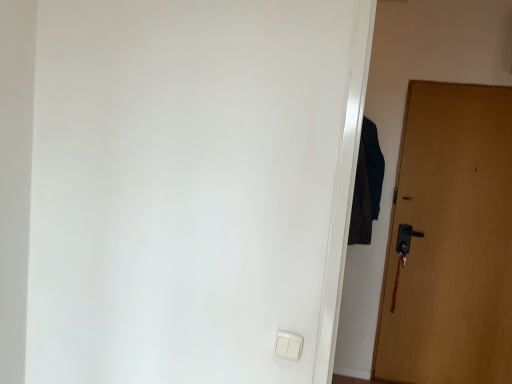
Question: Does wooden door at right appear on the left side of dark blue fabric at right?

Choices:
 (A) no
 (B) yes

Answer: (A)

Question: Considering the relative sizes of wooden door at right and dark blue fabric at right in the image provided, is wooden door at right shorter than dark blue fabric at right?

Choices:
 (A) yes
 (B) no

Answer: (B)

Question: Can you confirm if wooden door at right is bigger than dark blue fabric at right?

Choices:
 (A) yes
 (B) no

Answer: (A)

Question: From the image's perspective, would you say wooden door at right is positioned over dark blue fabric at right?

Choices:
 (A) no
 (B) yes

Answer: (A)

Question: Is wooden door at right thinner than dark blue fabric at right?

Choices:
 (A) no
 (B) yes

Answer: (B)

Question: Considering the relative sizes of wooden door at right and dark blue fabric at right in the image provided, is wooden door at right smaller than dark blue fabric at right?

Choices:
 (A) no
 (B) yes

Answer: (A)

Question: Is dark blue fabric at right bigger than white plastic light switch at lower center?

Choices:
 (A) no
 (B) yes

Answer: (B)

Question: Does dark blue fabric at right lie behind white plastic light switch at lower center?

Choices:
 (A) no
 (B) yes

Answer: (B)

Question: Could you tell me if dark blue fabric at right is turned towards white plastic light switch at lower center?

Choices:
 (A) no
 (B) yes

Answer: (A)

Question: Are dark blue fabric at right and white plastic light switch at lower center far apart?

Choices:
 (A) no
 (B) yes

Answer: (B)

Question: Is dark blue fabric at right closer to camera compared to white plastic light switch at lower center?

Choices:
 (A) yes
 (B) no

Answer: (B)

Question: From a real-world perspective, is dark blue fabric at right below white plastic light switch at lower center?

Choices:
 (A) no
 (B) yes

Answer: (A)

Question: From the image's perspective, is dark blue fabric at right on wooden door at right?

Choices:
 (A) yes
 (B) no

Answer: (A)